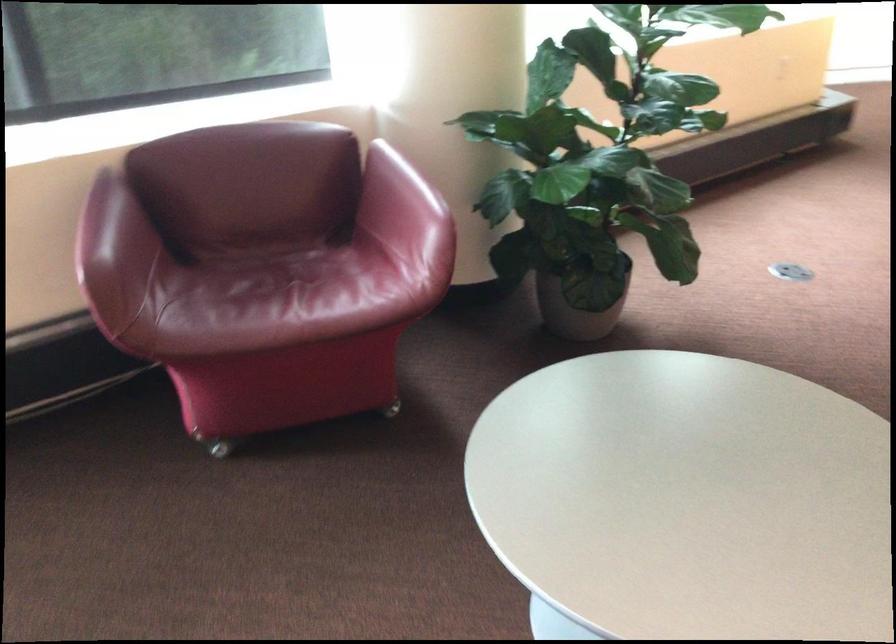
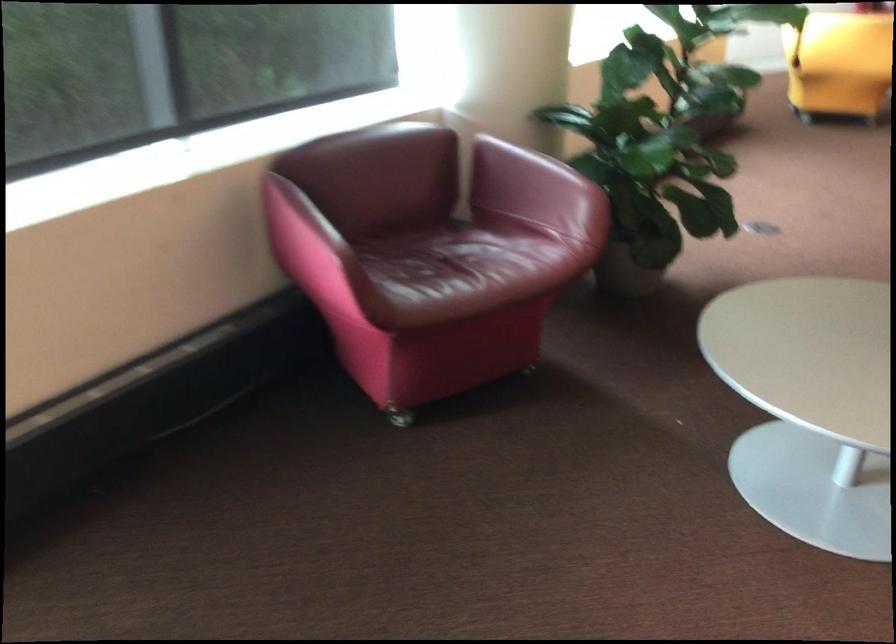
Where in the second image is the point corresponding to (409,190) from the first image?

(543, 169)